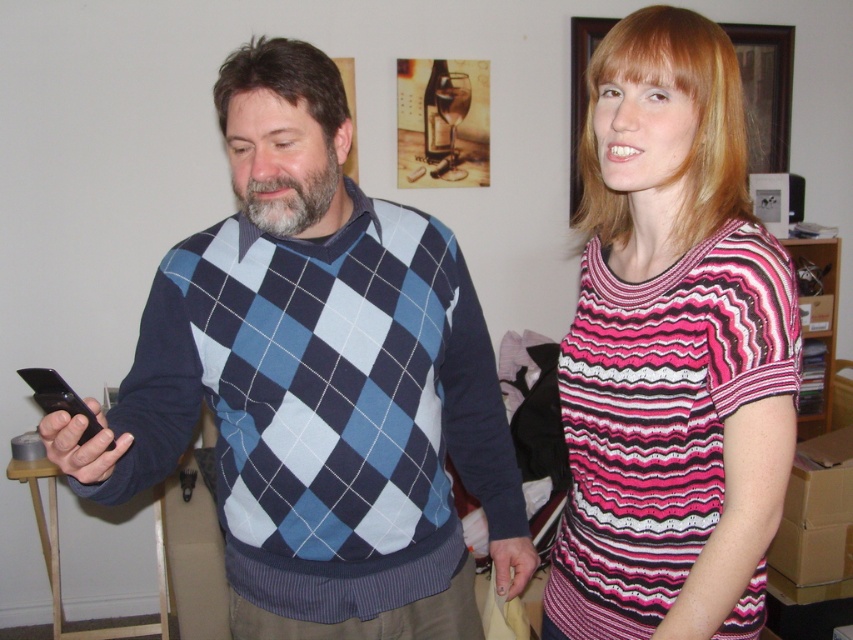
Based on the photo, you are a photographer trying to capture a candid shot of both the blue argyle sweater at center and the pink striped sweater at right in the scene. The camera you are using has a lens with a maximum focus range of 12 inches. Can you fit both sweaters into the frame without moving closer or farther away?

The blue argyle sweater at center is 12.77 inches from the pink striped sweater at right. Since the distance between them exceeds the 12 inch focus range, you cannot fit both into the frame without adjusting your position.

You are standing at the point with coordinates point (x=229, y=381) and want to walk to the point with coordinates point (x=718, y=524). Is there any obstacle between you and your destination?

Point (x=229, y=381) is behind point (x=718, y=524), so there is an obstacle between them.